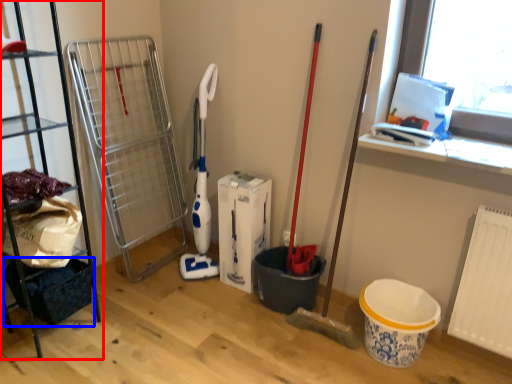
Question: Which of the following is the closest to the observer, shelf (highlighted by a red box) or basket (highlighted by a blue box)?

Choices:
 (A) shelf
 (B) basket

Answer: (A)